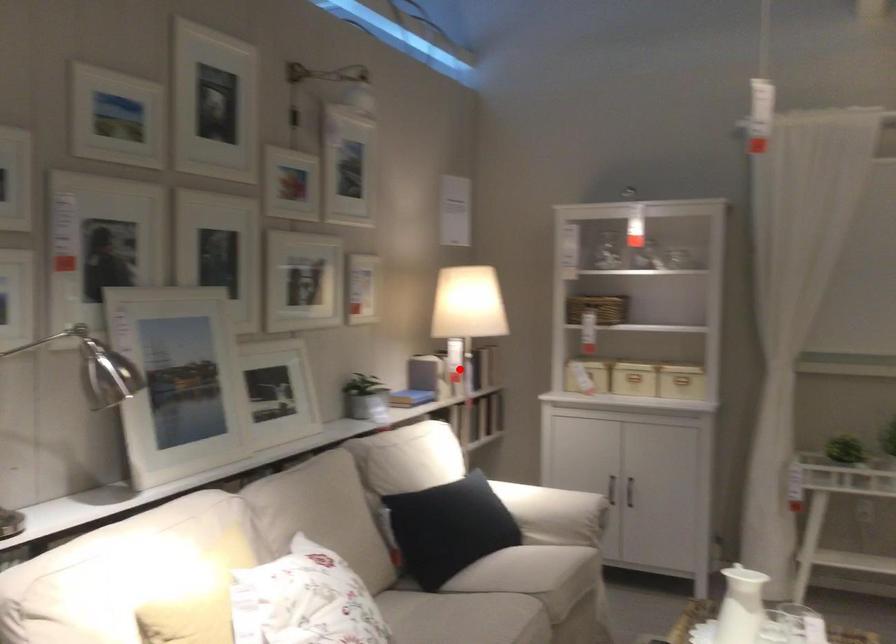
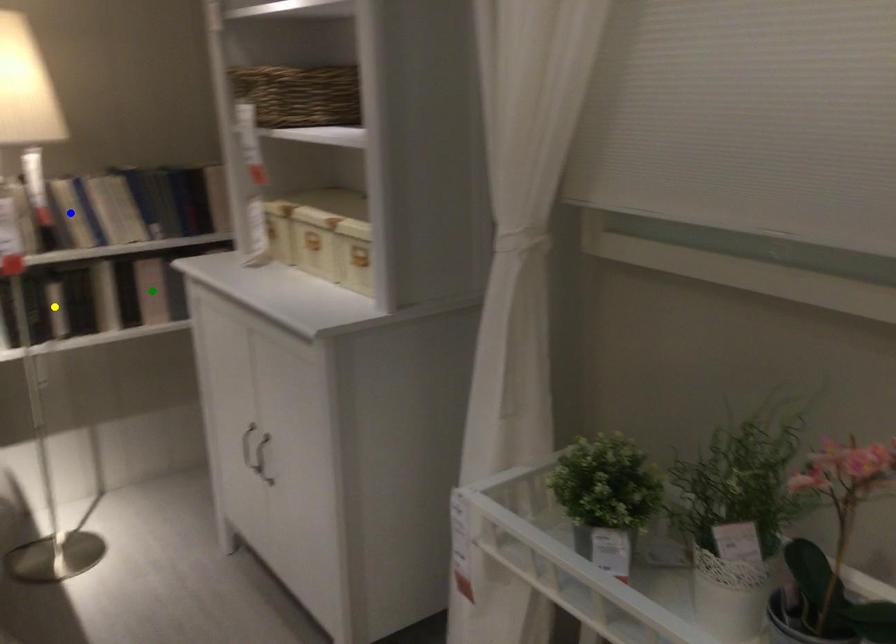
Question: I am providing you with two images of the same scene from different viewpoints. A red point is marked on the first image. You are given multiple points on the second image. Which point in image 2 represents the same 3d spot as the red point in image 1?

Choices:
 (A) green point
 (B) yellow point
 (C) blue point

Answer: (C)